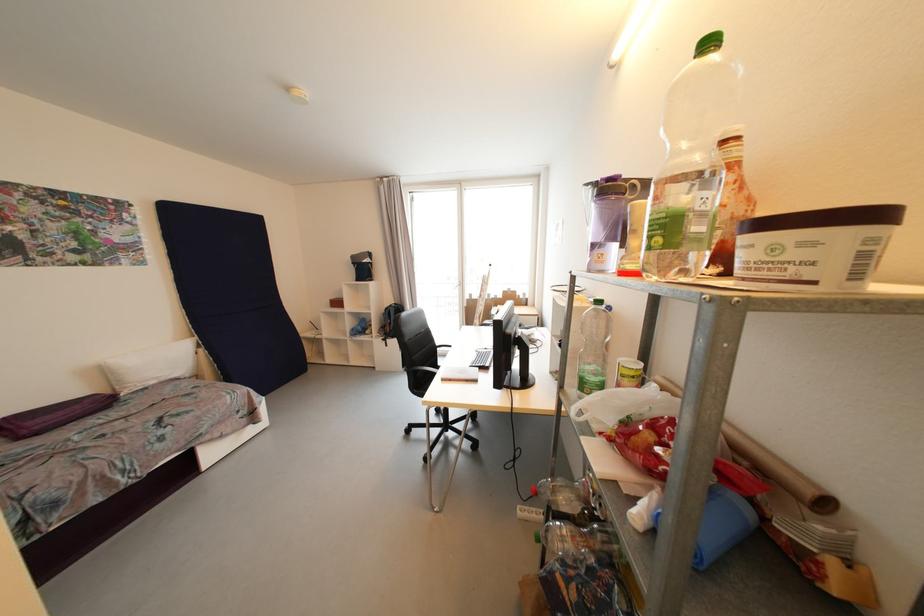
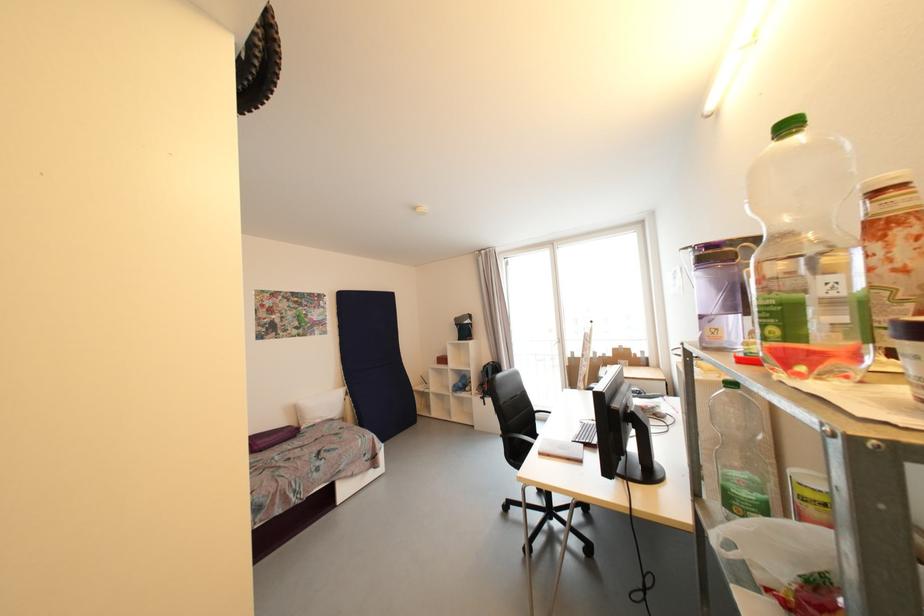
In the second image, find the point that corresponds to point 663,241 in the first image.

(780, 331)